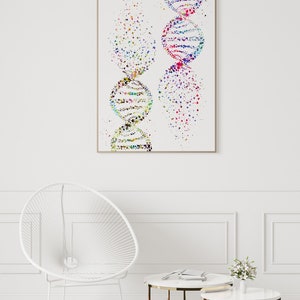
Identify the location of shape of chair with strings. The image size is (300, 300). (61, 182), (90, 281), (20, 236), (125, 220).